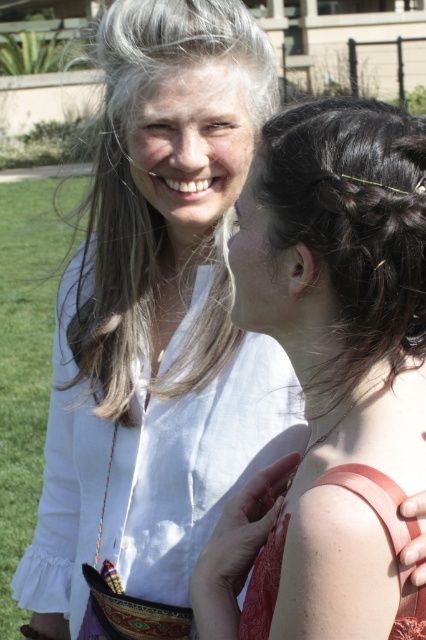
Can you confirm if white cotton shirt at upper center is taller than grayhair at upper center?

In fact, white cotton shirt at upper center may be shorter than grayhair at upper center.

Between point (95, 449) and point (143, 202), which one is positioned behind?

The point (143, 202) is behind.

Describe the element at coordinates (193, 464) in the screenshot. I see `white cotton shirt at upper center` at that location.

Locate an element on the screen. white cotton shirt at upper center is located at coordinates point(193,464).

Does matte red dress at center lie behind white cotton shirt at upper center?

No, it is not.

Is matte red dress at center closer to camera compared to white cotton shirt at upper center?

Yes, it is in front of white cotton shirt at upper center.

Between point (403, 536) and point (131, 538), which one is positioned behind?

Point (131, 538)

Find the location of `matte red dress at center`. matte red dress at center is located at coordinates (331, 380).

The image size is (426, 640). Find the location of `matte red dress at center`. matte red dress at center is located at coordinates (331, 380).

Which is in front, point (351, 384) or point (100, 141)?

Point (351, 384) is more forward.

Locate an element on the screen. matte red dress at center is located at coordinates (331, 380).